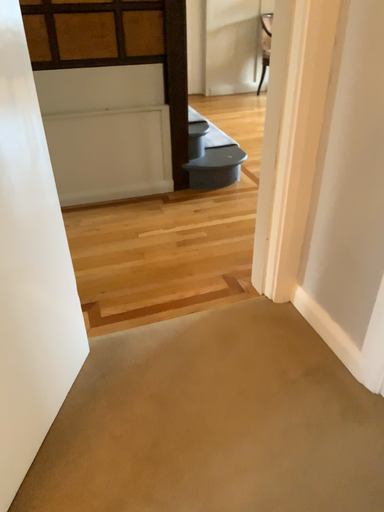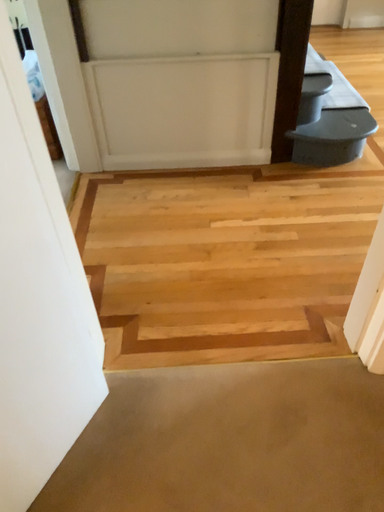
Question: Which way did the camera rotate in the video?

Choices:
 (A) rotated upward
 (B) rotated downward

Answer: (B)